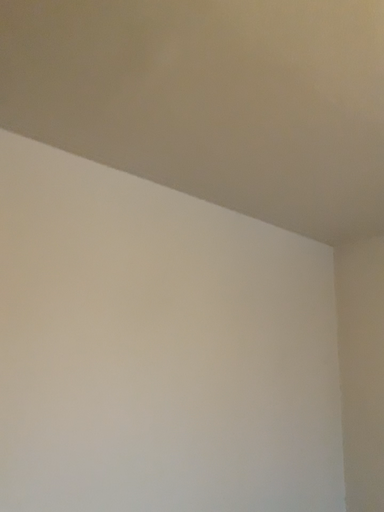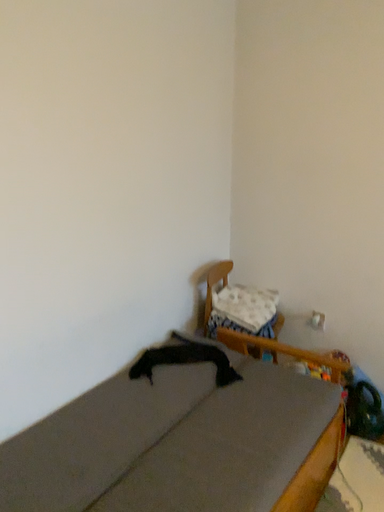
Question: Which way did the camera rotate in the video?

Choices:
 (A) rotated left
 (B) rotated right

Answer: (B)